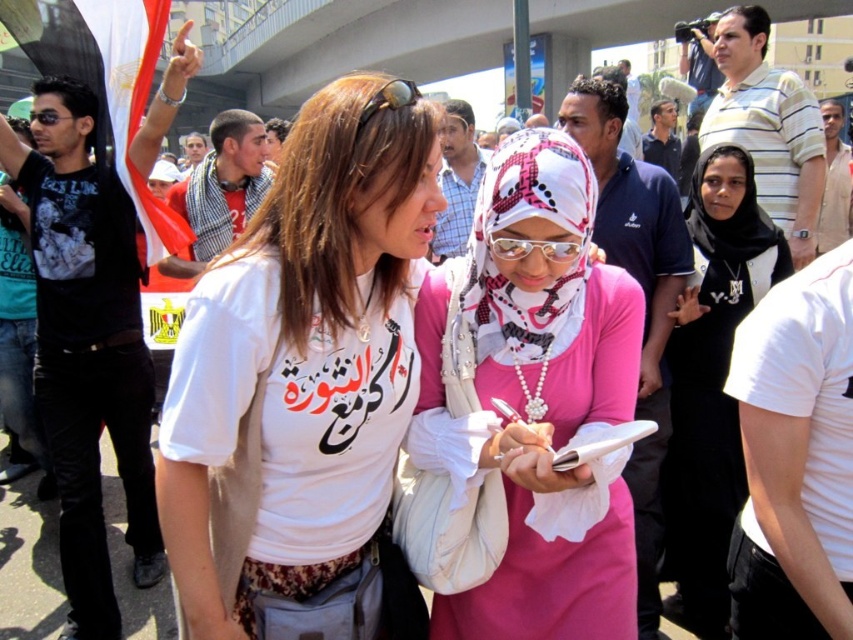
You are an observer standing in the middle of the crowd at this outdoor event. You notice two items at the center of your view, the black jersey at center and the transparent plastic goggles at center. Which item appears taller to you?

The black jersey at center appears taller than the transparent plastic goggles at center.

From the picture: You are a photographer trying to capture a closeup shot of the gold metallic goggles at center. However, the pink satin hijab at center is blocking your view. Based on the scene description, can you estimate whether the hijab is wider than the goggles?

The pink satin hijab at center might be wider than gold metallic goggles at center, so there is a possibility that the hijab is blocking the view of the goggles.